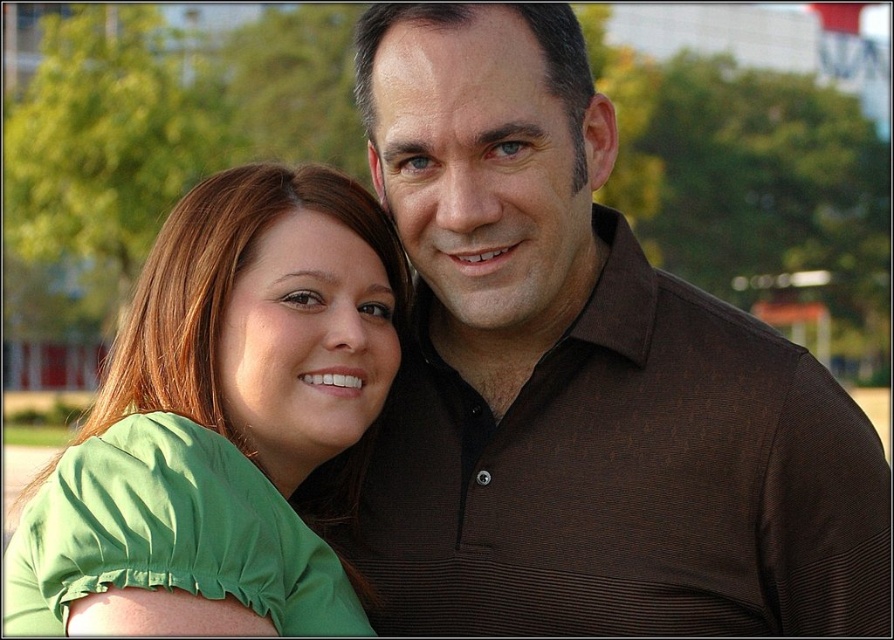
You are taking a photo of two people standing outdoors. The woman is wearing a green top and the man is wearing a brown textured shirt at center. Based on their positions, which object is closer to the camera?

The brown textured shirt at center is located at point (x=580, y=380), which is closer to the camera than the woman wearing the green top.

You are standing in front of the scene and want to place a small flower between the two points, point (448,161) and point (121,474). Which point should the flower be closer to in order to be closer to the viewer?

The flower should be placed closer to point (448,161) because it is closer to the viewer than point (121,474).